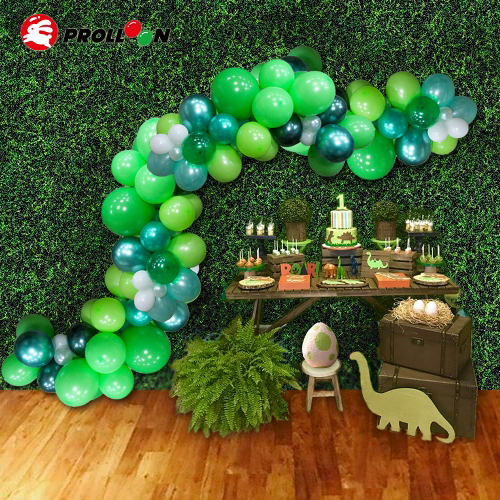
At what (x,y) coordinates should I click in order to perform the action: click on dark brown table. Please return your answer as a coordinate pair (x, y). Looking at the image, I should click on (244, 294).